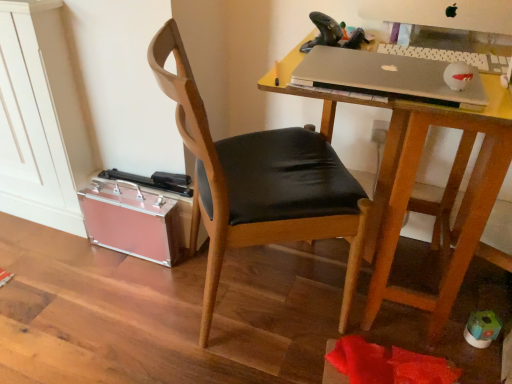
Question: Visually, is wooden desk at center positioned to the left or to the right of silver metallic keyboard at upper right?

Choices:
 (A) left
 (B) right

Answer: (A)

Question: Is wooden desk at center in front of or behind silver metallic keyboard at upper right in the image?

Choices:
 (A) behind
 (B) front

Answer: (B)

Question: Which is farther from the silver metallic keyboard at upper right?

Choices:
 (A) wooden desk at center
 (B) wooden chair at center
 (C) silver metallic laptop at upper right

Answer: (B)

Question: Estimate the real-world distances between objects in this image. Which object is closer to the wooden chair at center?

Choices:
 (A) silver metallic keyboard at upper right
 (B) wooden desk at center
 (C) silver metallic laptop at upper right

Answer: (B)